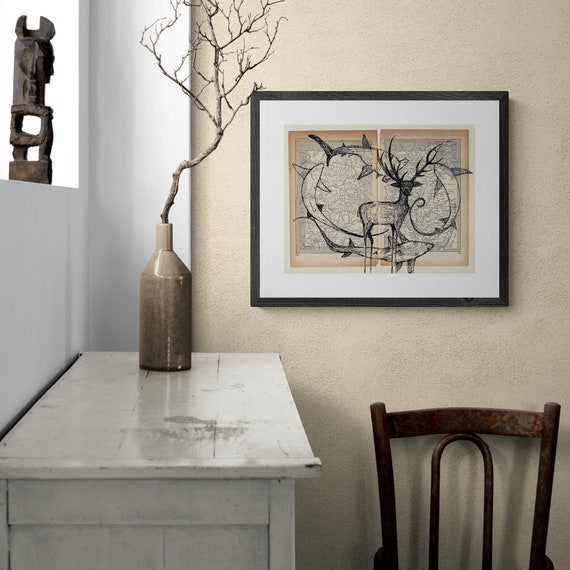
Locate an element on the screen. The width and height of the screenshot is (570, 570). 2 colors on table is located at coordinates (203, 424), (260, 403).